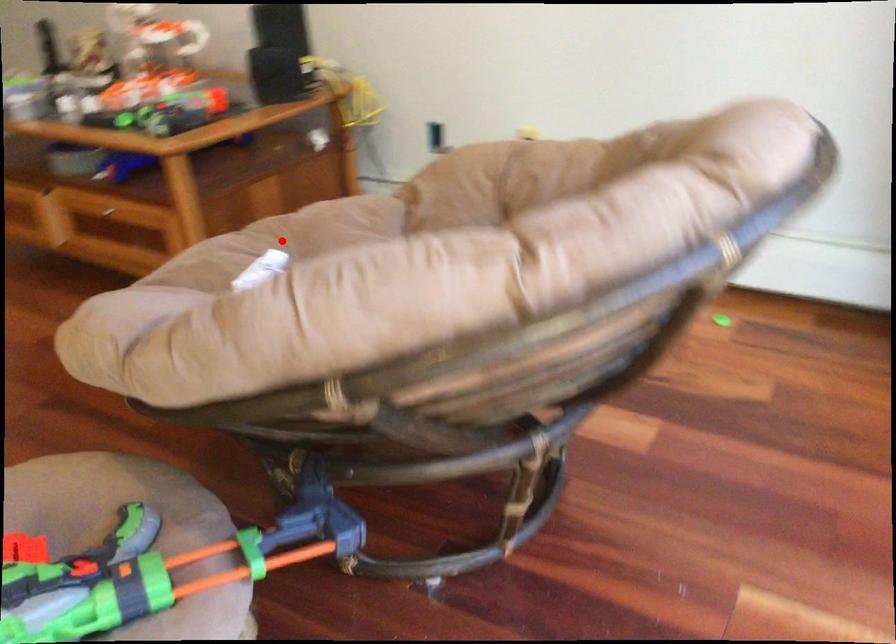
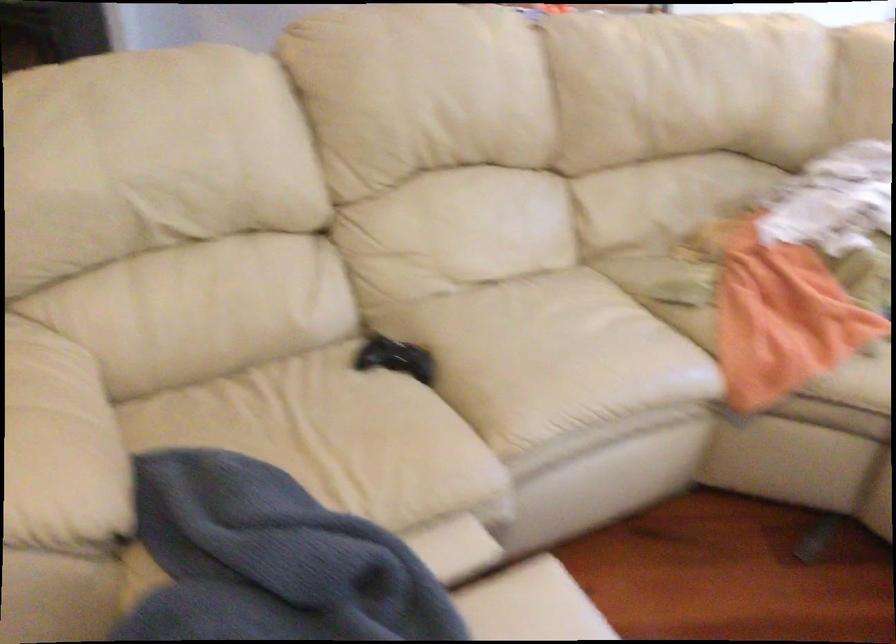
Question: I am providing you with two images of the same scene from different viewpoints. A red point is marked on the first image. At the location where the point appears in image 1, is it still visible in image 2?

Choices:
 (A) Yes
 (B) No

Answer: (B)